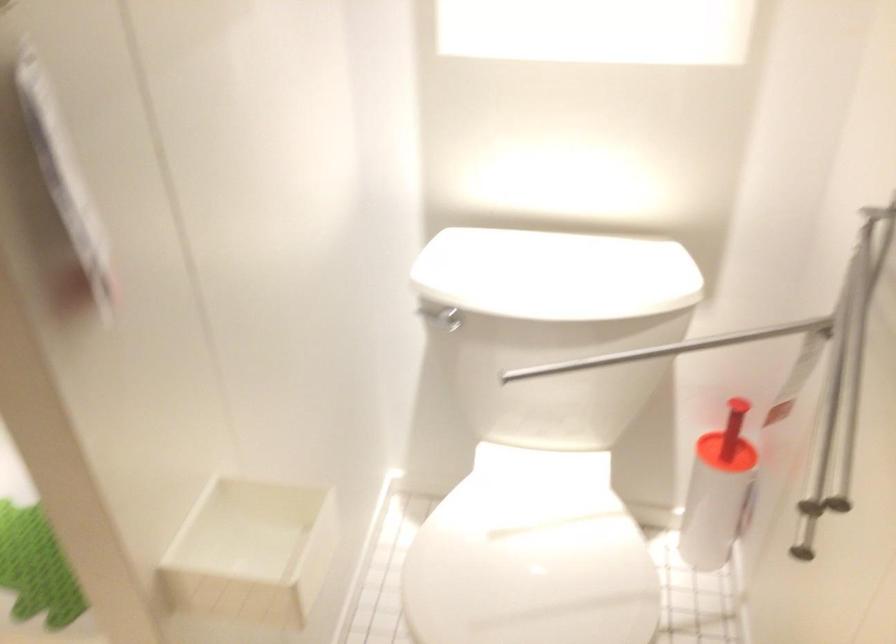
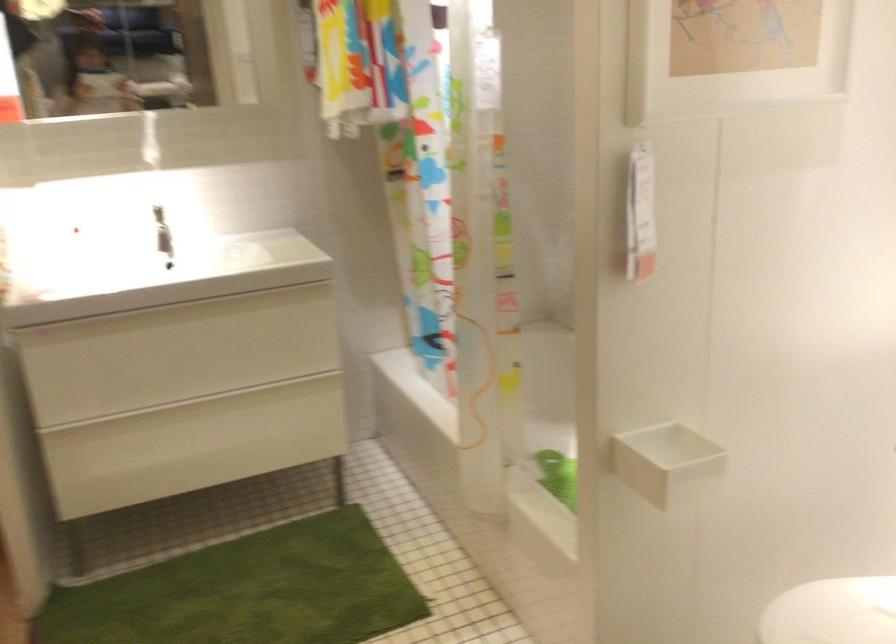
Question: Based on the continuous images, in which direction is the camera rotating? Reply with the corresponding letter.

Choices:
 (A) Left
 (B) Right
 (C) Up
 (D) Down

Answer: (A)